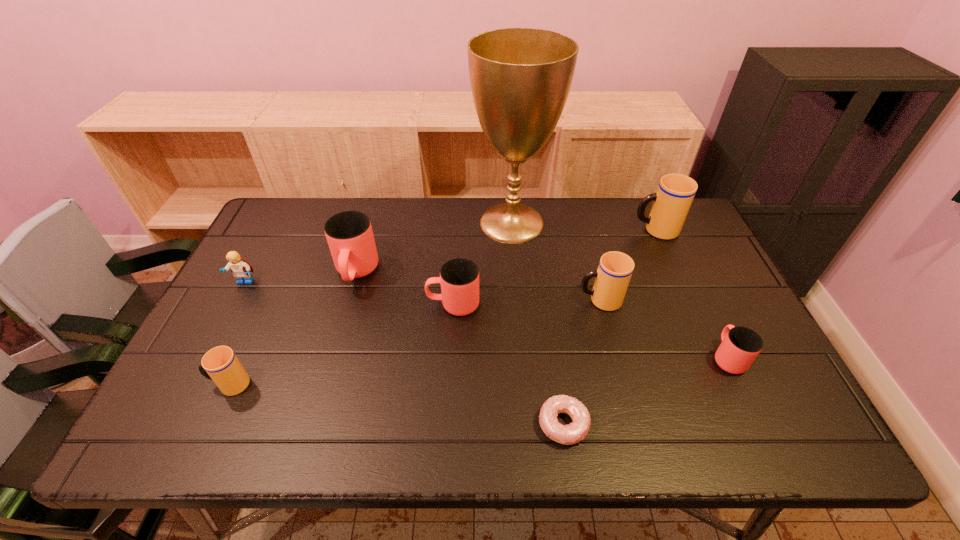
In the image, there is a desktop. Where is `free space at the left edge`? free space at the left edge is located at coordinates (265, 294).

This screenshot has height=540, width=960. Find the location of `vacant space at the right edge of the desktop`. vacant space at the right edge of the desktop is located at coordinates (688, 255).

At what (x,y) coordinates should I click in order to perform the action: click on free space at the far left corner. Please return your answer as a coordinate pair (x, y). Looking at the image, I should click on click(313, 222).

In the image, there is a desktop. Identify the location of vacant space at the far right corner. Image resolution: width=960 pixels, height=540 pixels. (688, 237).

The width and height of the screenshot is (960, 540). In order to click on vacant space at the near right corner of the desktop in this screenshot , I will do `click(781, 446)`.

Identify the location of vacant space in between the pink doughnut and the second smallest pink cup. (508, 364).

You are a GUI agent. You are given a task and a screenshot of the screen. Output one action in this format:
    pyautogui.click(x=<x>, y=<y>)
    Task: Click on the empty location between the second cup from left to right and the farthest beige cup
    
    Given the screenshot: What is the action you would take?
    pyautogui.click(x=506, y=252)

Locate an element on the screen. The image size is (960, 540). vacant space that is in between the trophy cup and the nearest beige cup is located at coordinates (371, 303).

At what (x,y) coordinates should I click in order to perform the action: click on empty space between the shortest object and the second pink cup from left to right. Please return your answer as a coordinate pair (x, y). This screenshot has width=960, height=540. Looking at the image, I should click on (508, 364).

Locate an element on the screen. vacant point located between the smallest beige cup and the leftmost pink cup is located at coordinates tap(293, 328).